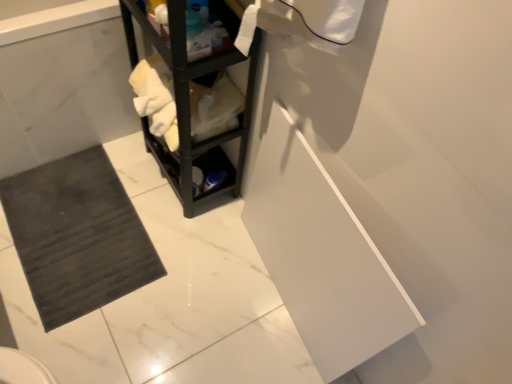
You are a GUI agent. You are given a task and a screenshot of the screen. Output one action in this format:
    pyautogui.click(x=<x>, y=<y>)
    Task: Click on the black matte shelf at center
    The width and height of the screenshot is (512, 384).
    Given the screenshot: What is the action you would take?
    pyautogui.click(x=189, y=104)

In order to click on dark gray rubber bath mat at lower left in this screenshot , I will do `click(77, 236)`.

What do you see at coordinates (77, 236) in the screenshot? I see `dark gray rubber bath mat at lower left` at bounding box center [77, 236].

Where is `dark gray rubber bath mat at lower left`? dark gray rubber bath mat at lower left is located at coordinates (64, 89).

Describe the element at coordinates (64, 89) in the screenshot. The image size is (512, 384). I see `dark gray rubber bath mat at lower left` at that location.

The width and height of the screenshot is (512, 384). What are the coordinates of `black matte shelf at center` in the screenshot? It's located at (189, 104).

How many degrees apart are the facing directions of dark gray rubber bath mat at lower left and dark gray rubber bath mat at lower left?

There is a 0.739-degree angle between the facing directions of dark gray rubber bath mat at lower left and dark gray rubber bath mat at lower left.

Is there a large distance between dark gray rubber bath mat at lower left and dark gray rubber bath mat at lower left?

No.

Is point (41, 72) positioned before point (129, 229)?

That is True.

Considering the sizes of objects dark gray rubber bath mat at lower left and dark gray rubber bath mat at lower left in the image provided, who is thinner, dark gray rubber bath mat at lower left or dark gray rubber bath mat at lower left?

With smaller width is dark gray rubber bath mat at lower left.

Which is closer, (90, 283) or (13, 88)?

Clearly, point (90, 283) is more distant from the camera than point (13, 88).

Which is more to the left, dark gray rubber bath mat at lower left or dark gray rubber bath mat at lower left?

From the viewer's perspective, dark gray rubber bath mat at lower left appears more on the left side.

Is dark gray rubber bath mat at lower left facing towards dark gray rubber bath mat at lower left?

No, dark gray rubber bath mat at lower left is not facing towards dark gray rubber bath mat at lower left.

Is dark gray rubber bath mat at lower left wider than dark gray rubber bath mat at lower left?

Yes.

Is dark gray rubber bath mat at lower left not close to black matte shelf at center?

dark gray rubber bath mat at lower left is actually quite close to black matte shelf at center.

From a real-world perspective, is dark gray rubber bath mat at lower left located beneath black matte shelf at center?

Indeed, from a real-world perspective, dark gray rubber bath mat at lower left is positioned beneath black matte shelf at center.

Where is `shelf in front of the dark gray rubber bath mat at lower left`? This screenshot has width=512, height=384. shelf in front of the dark gray rubber bath mat at lower left is located at coordinates (189, 104).

Measure the distance from dark gray rubber bath mat at lower left to black matte shelf at center.

dark gray rubber bath mat at lower left and black matte shelf at center are 16.49 inches apart.

Who is smaller, black matte shelf at center or dark gray rubber bath mat at lower left?

With smaller size is dark gray rubber bath mat at lower left.

In order to click on shelf that appears below the dark gray rubber bath mat at lower left (from the image's perspective) in this screenshot , I will do `click(189, 104)`.

Can dark gray rubber bath mat at lower left be found inside black matte shelf at center?

No, black matte shelf at center does not contain dark gray rubber bath mat at lower left.

Is black matte shelf at center positioned in front of dark gray rubber bath mat at lower left?

That is True.

Is dark gray rubber bath mat at lower left at the left side of black matte shelf at center?

Indeed, dark gray rubber bath mat at lower left is positioned on the left side of black matte shelf at center.

Identify the location of bath below the black matte shelf at center (from a real-world perspective). Image resolution: width=512 pixels, height=384 pixels. (64, 89).

Is dark gray rubber bath mat at lower left wider than black matte shelf at center?

Incorrect, the width of dark gray rubber bath mat at lower left does not surpass that of black matte shelf at center.

From the image's perspective, which object appears higher, dark gray rubber bath mat at lower left or black matte shelf at center?

dark gray rubber bath mat at lower left.

Which is in front, point (170, 162) or point (4, 211)?

The point (4, 211) is closer.

Based on their sizes in the image, would you say black matte shelf at center is bigger or smaller than dark gray rubber bath mat at lower left?

Considering their sizes, black matte shelf at center takes up more space than dark gray rubber bath mat at lower left.

Looking at this image, is black matte shelf at center taller than dark gray rubber bath mat at lower left?

Correct, black matte shelf at center is much taller as dark gray rubber bath mat at lower left.

Based on the photo, between black matte shelf at center and dark gray rubber bath mat at lower left, which one is positioned in front?

black matte shelf at center is in front.

Find the location of `bath in front of the dark gray rubber bath mat at lower left`. bath in front of the dark gray rubber bath mat at lower left is located at coordinates (64, 89).

This screenshot has height=384, width=512. Identify the location of bath mat that is under the dark gray rubber bath mat at lower left (from a real-world perspective). (77, 236).

Which object lies nearer to the anchor point dark gray rubber bath mat at lower left, dark gray rubber bath mat at lower left or black matte shelf at center?

The object closer to dark gray rubber bath mat at lower left is black matte shelf at center.

Considering their positions, is dark gray rubber bath mat at lower left positioned closer to black matte shelf at center than dark gray rubber bath mat at lower left?

dark gray rubber bath mat at lower left.

When comparing their distances from black matte shelf at center, does dark gray rubber bath mat at lower left or dark gray rubber bath mat at lower left seem closer?

dark gray rubber bath mat at lower left lies closer to black matte shelf at center than the other object.

Based on their spatial positions, is black matte shelf at center or dark gray rubber bath mat at lower left further from dark gray rubber bath mat at lower left?

black matte shelf at center.

Based on their spatial positions, is black matte shelf at center or dark gray rubber bath mat at lower left further from dark gray rubber bath mat at lower left?

dark gray rubber bath mat at lower left is positioned further to the anchor dark gray rubber bath mat at lower left.

From the picture: Which object lies further to the anchor point dark gray rubber bath mat at lower left, dark gray rubber bath mat at lower left or black matte shelf at center?

black matte shelf at center lies further to dark gray rubber bath mat at lower left than the other object.

Find the location of a particular element. This screenshot has height=384, width=512. bath located between black matte shelf at center and dark gray rubber bath mat at lower left in the depth direction is located at coordinates (64, 89).